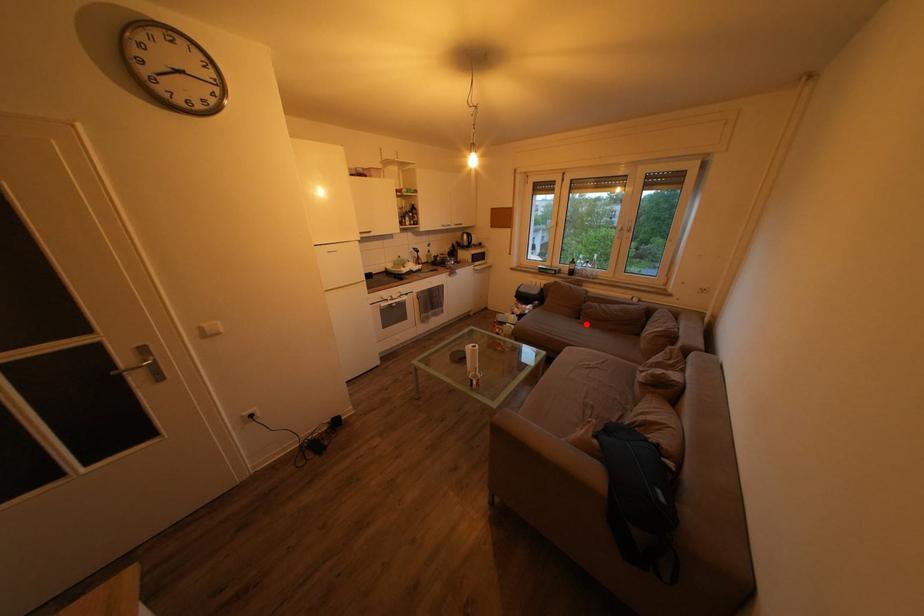
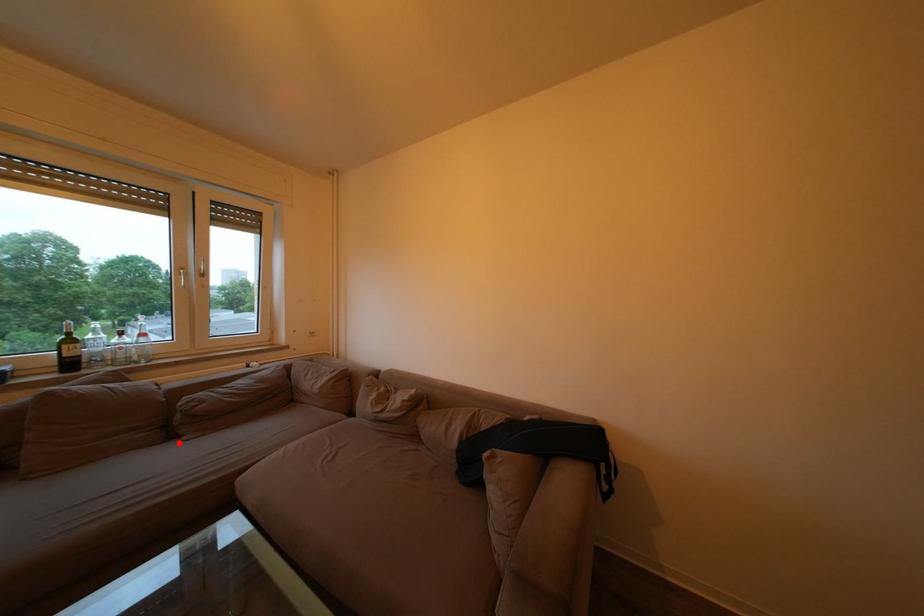
I am providing you with two images of the same scene from different viewpoints. A red point is marked on the first image and another point is marked on the second image. Is the red point in image1 aligned with the point shown in image2?

Yes